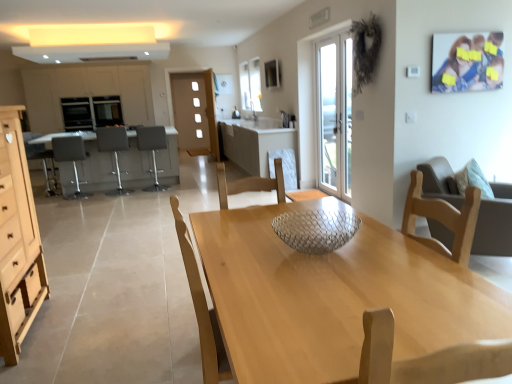
I want to click on free location above matte plastic photo frame at upper right (from a real-world perspective), so click(462, 31).